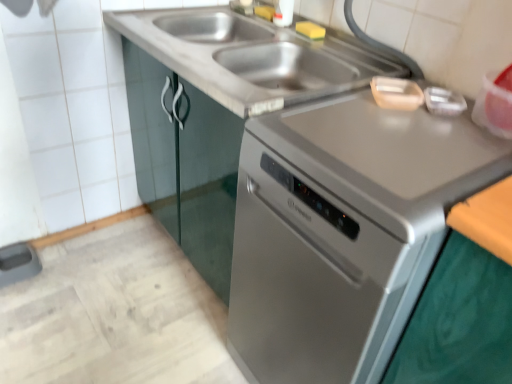
Question: Is stainless steel sink at center oriented towards satin silver dishwasher at center?

Choices:
 (A) yes
 (B) no

Answer: (B)

Question: Is stainless steel sink at center with satin silver dishwasher at center?

Choices:
 (A) yes
 (B) no

Answer: (B)

Question: From the image's perspective, is stainless steel sink at center over satin silver dishwasher at center?

Choices:
 (A) no
 (B) yes

Answer: (B)

Question: Does stainless steel sink at center have a smaller size compared to satin silver dishwasher at center?

Choices:
 (A) yes
 (B) no

Answer: (A)

Question: Is stainless steel sink at center surrounding satin silver dishwasher at center?

Choices:
 (A) yes
 (B) no

Answer: (B)

Question: Is stainless steel sink at center positioned before satin silver dishwasher at center?

Choices:
 (A) yes
 (B) no

Answer: (B)

Question: Does satin silver dishwasher at center have a lesser height compared to stainless steel sink at center?

Choices:
 (A) no
 (B) yes

Answer: (A)

Question: From a real-world perspective, is satin silver dishwasher at center located beneath stainless steel sink at center?

Choices:
 (A) yes
 (B) no

Answer: (A)

Question: Considering the relative sizes of satin silver dishwasher at center and stainless steel sink at center in the image provided, is satin silver dishwasher at center bigger than stainless steel sink at center?

Choices:
 (A) yes
 (B) no

Answer: (A)

Question: Would you say satin silver dishwasher at center is a long distance from stainless steel sink at center?

Choices:
 (A) no
 (B) yes

Answer: (A)

Question: Is stainless steel sink at center inside satin silver dishwasher at center?

Choices:
 (A) no
 (B) yes

Answer: (A)

Question: From the image's perspective, is satin silver dishwasher at center under stainless steel sink at center?

Choices:
 (A) no
 (B) yes

Answer: (B)

Question: From the image's perspective, is stainless steel sink at center located above or below satin silver dishwasher at center?

Choices:
 (A) below
 (B) above

Answer: (B)